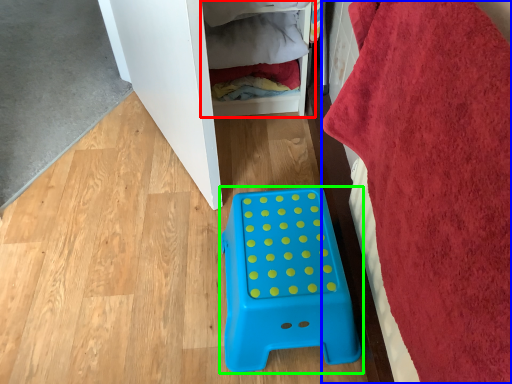
Question: Based on their relative distances, which object is nearer to shelf (highlighted by a red box)? Choose from bath towel (highlighted by a blue box) and furniture (highlighted by a green box).

Choices:
 (A) bath towel
 (B) furniture

Answer: (B)